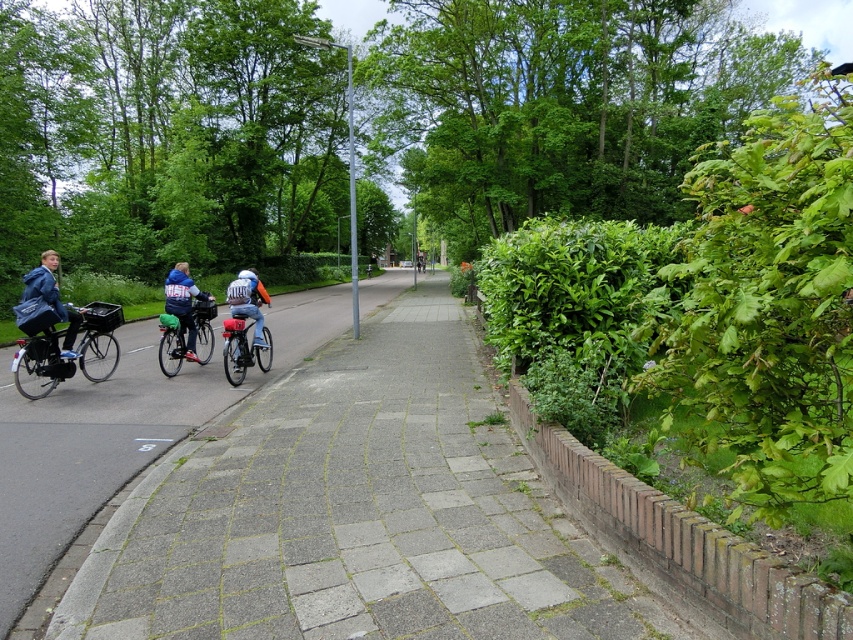
Between point (242, 369) and point (173, 310), which one is positioned in front?

Point (242, 369)

Between shiny blue bicycle at center and blue denim jacket at center, which one appears on the left side from the viewer's perspective?

From the viewer's perspective, blue denim jacket at center appears more on the left side.

Between point (242, 376) and point (193, 330), which one is positioned behind?

The point (193, 330) is behind.

Where is `shiny blue bicycle at center`? shiny blue bicycle at center is located at coordinates (242, 348).

Between gray concrete pavement at center and matte black bicycle at left, which one is positioned lower?

matte black bicycle at left is below.

Between gray concrete pavement at center and matte black bicycle at left, which one is positioned higher?

gray concrete pavement at center is higher up.

At what (x,y) coordinates should I click in order to perform the action: click on gray concrete pavement at center. Please return your answer as a coordinate pair (x, y). Looking at the image, I should click on (119, 432).

Is gray concrete pavement at center positioned behind matte blue helmet at center?

That is False.

Does gray concrete pavement at center have a larger size compared to matte blue helmet at center?

Answer: Yes, gray concrete pavement at center is bigger than matte blue helmet at center.

You are a GUI agent. You are given a task and a screenshot of the screen. Output one action in this format:
    pyautogui.click(x=<x>, y=<y>)
    Task: Click on the gray concrete pavement at center
    The height and width of the screenshot is (640, 853).
    Given the screenshot: What is the action you would take?
    pyautogui.click(x=119, y=432)